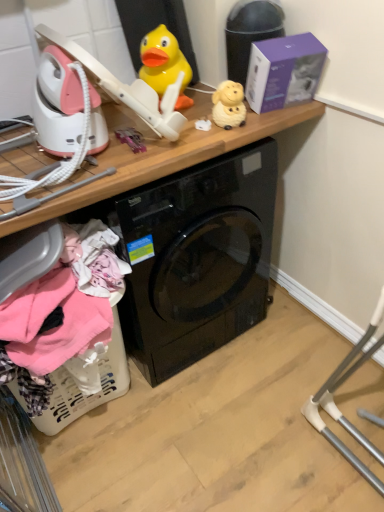
Question: Does purple matte box at upper right have a greater width compared to wooden at upper center?

Choices:
 (A) yes
 (B) no

Answer: (B)

Question: Is purple matte box at upper right not within wooden at upper center?

Choices:
 (A) no
 (B) yes

Answer: (B)

Question: Considering the relative sizes of purple matte box at upper right and wooden at upper center in the image provided, is purple matte box at upper right taller than wooden at upper center?

Choices:
 (A) yes
 (B) no

Answer: (B)

Question: From a real-world perspective, is purple matte box at upper right beneath wooden at upper center?

Choices:
 (A) no
 (B) yes

Answer: (A)

Question: Considering the relative positions of purple matte box at upper right and wooden at upper center in the image provided, is purple matte box at upper right to the right of wooden at upper center from the viewer's perspective?

Choices:
 (A) no
 (B) yes

Answer: (B)

Question: Relative to purple matte box at upper right, is yellow rubber duck at upper center, the second toy positioned from the right, in front or behind?

Choices:
 (A) front
 (B) behind

Answer: (B)

Question: Is yellow rubber duck at upper center, the second toy positioned from the right, spatially inside purple matte box at upper right, or outside of it?

Choices:
 (A) outside
 (B) inside

Answer: (A)

Question: In terms of height, does yellow rubber duck at upper center, the first toy viewed from the left, look taller or shorter compared to purple matte box at upper right?

Choices:
 (A) short
 (B) tall

Answer: (A)

Question: Looking at their shapes, would you say yellow rubber duck at upper center, the first toy viewed from the left, is wider or thinner than purple matte box at upper right?

Choices:
 (A) thin
 (B) wide

Answer: (B)

Question: From the image's perspective, is wooden at upper center positioned above or below yellow rubber duck at upper center, the second toy positioned from the right?

Choices:
 (A) below
 (B) above

Answer: (A)

Question: Looking at their shapes, would you say wooden at upper center is wider or thinner than yellow rubber duck at upper center, the first toy viewed from the left?

Choices:
 (A) thin
 (B) wide

Answer: (B)

Question: Looking at the image, does wooden at upper center seem bigger or smaller compared to yellow rubber duck at upper center, the first toy viewed from the left?

Choices:
 (A) big
 (B) small

Answer: (A)

Question: Is wooden at upper center taller or shorter than yellow rubber duck at upper center, the second toy positioned from the right?

Choices:
 (A) tall
 (B) short

Answer: (A)

Question: Looking at their shapes, would you say purple matte box at upper right is wider or thinner than yellow rubber duck at upper center, the first toy viewed from the left?

Choices:
 (A) wide
 (B) thin

Answer: (B)

Question: From a real-world perspective, is purple matte box at upper right physically located above or below yellow rubber duck at upper center, the first toy viewed from the left?

Choices:
 (A) above
 (B) below

Answer: (B)